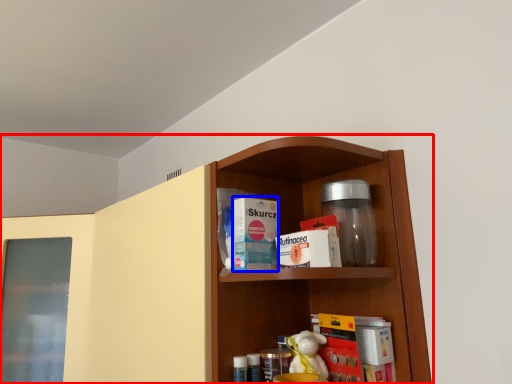
Question: Among these objects, which one is nearest to the camera, shelf (highlighted by a red box) or product (highlighted by a blue box)?

Choices:
 (A) shelf
 (B) product

Answer: (A)